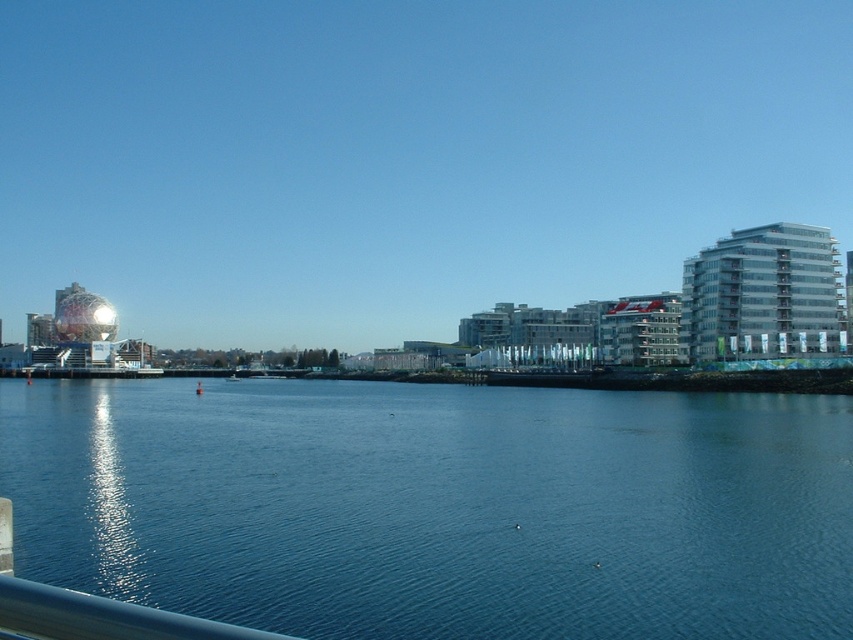
In the scene shown: You are standing on a bridge and see the blue water at center and the metallic blue rail at lower left. Which object is positioned to the right side from your viewpoint?

The metallic blue rail at lower left is positioned to the right of the blue water at center.

Consider the image. You are a photographer trying to capture the waterfront scene. You need to ensure that the blue water at center and the metallic blue rail at lower left are both in focus. Based on their positions, which object should you focus on first to ensure both are sharp in the photo?

The blue water at center is wider than the metallic blue rail at lower left, so you should focus on the blue water at center first to ensure both are in focus.